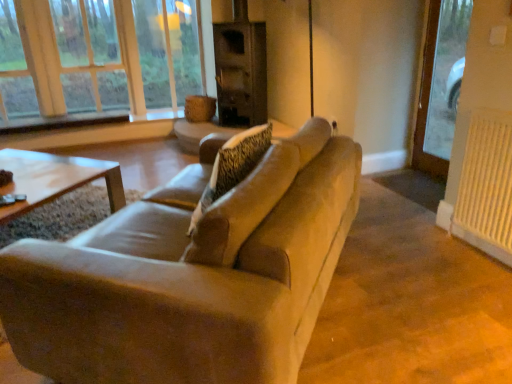
Where is `free region under white textured radiator at right (from a real-world perspective)`? The image size is (512, 384). free region under white textured radiator at right (from a real-world perspective) is located at coordinates click(x=473, y=246).